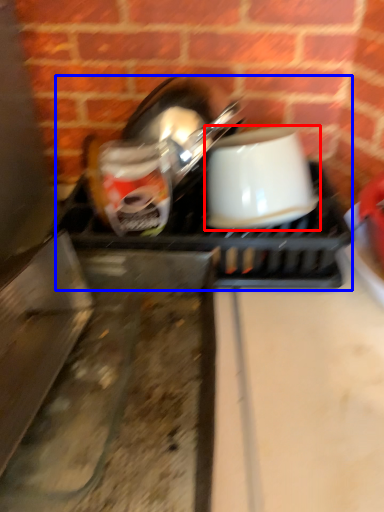
Question: Which point is further to the camera, coffee cup (highlighted by a red box) or appliance (highlighted by a blue box)?

Choices:
 (A) coffee cup
 (B) appliance

Answer: (B)